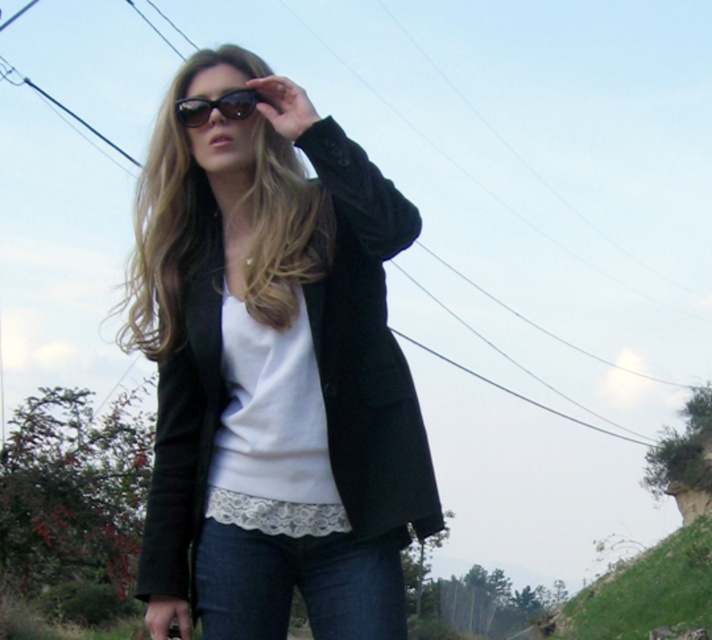
You are a fashion designer trying to create a matching outfit for the person in the image. Given that the black velvet jacket at center and denim jeans at lower center are part of their current outfit, can you determine if the jacket and jeans are close enough to form a cohesive look based on their spatial arrangement?

The black velvet jacket at center and denim jeans at lower center are 12.99 inches apart, which is a close enough distance to form a cohesive look as they are part of the same outfit.

You are a fashion photographer and want to capture the model wearing the black velvet jacket at center in a way that emphasizes the jacket while still including the power lines in the background. Given the distance between the model and the power lines, can you position yourself close enough to the model to ensure both the jacket details and the power lines are visible in the frame?

The model wearing the black velvet jacket at center and the power lines are 8.94 feet apart. To capture both the jacket details and the power lines in the frame, you can position yourself close enough to the model while ensuring the camera angle includes the power lines in the background. The distance allows for a balanced composition where both elements are visible.